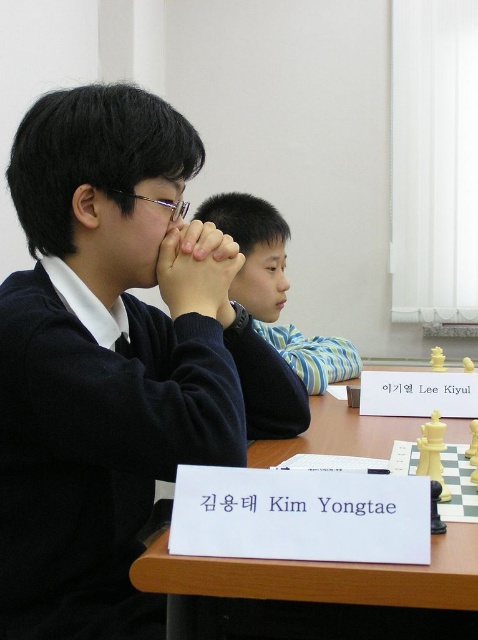
Measure the distance between wooden table at center and blue striped shirt at center.

30.45 centimeters

Is wooden table at center positioned in front of blue striped shirt at center?

Yes, wooden table at center is closer to the viewer.

You are a GUI agent. You are given a task and a screenshot of the screen. Output one action in this format:
    pyautogui.click(x=<x>, y=<y>)
    Task: Click on the wooden table at center
    Image resolution: width=478 pixels, height=640 pixels.
    Given the screenshot: What is the action you would take?
    pyautogui.click(x=315, y=579)

Who is positioned more to the left, dark blue sweater at center or blue striped shirt at center?

dark blue sweater at center

Locate an element on the screen. The height and width of the screenshot is (640, 478). dark blue sweater at center is located at coordinates (113, 358).

Can you confirm if dark blue sweater at center is positioned to the right of wooden table at center?

In fact, dark blue sweater at center is to the left of wooden table at center.

Describe the element at coordinates (113, 358) in the screenshot. This screenshot has height=640, width=478. I see `dark blue sweater at center` at that location.

Does point (111, 132) come behind point (293, 596)?

Yes.

Locate an element on the screen. Image resolution: width=478 pixels, height=640 pixels. dark blue sweater at center is located at coordinates (113, 358).